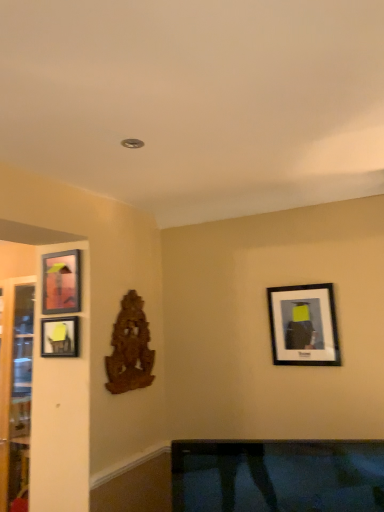
Question: Is matte black picture frame at left, acting as the 3th picture frame starting from the right, closer to camera compared to matte black picture frame at left, the 2th picture frame from the left?

Choices:
 (A) yes
 (B) no

Answer: (B)

Question: Is matte black picture frame at left, marked as the first picture frame in a left-to-right arrangement, behind matte black picture frame at left, the 2th picture frame from the left?

Choices:
 (A) yes
 (B) no

Answer: (A)

Question: Does matte black picture frame at left, acting as the 3th picture frame starting from the right, have a smaller size compared to matte black picture frame at left, arranged as the 2th picture frame when viewed from the right?

Choices:
 (A) no
 (B) yes

Answer: (A)

Question: Could you tell me if matte black picture frame at left, acting as the 3th picture frame starting from the right, is turned towards matte black picture frame at left, the 2th picture frame from the left?

Choices:
 (A) yes
 (B) no

Answer: (B)

Question: Is matte black picture frame at left, the 2th picture frame from the left, a part of matte black picture frame at left, marked as the first picture frame in a left-to-right arrangement?

Choices:
 (A) yes
 (B) no

Answer: (B)

Question: Is matte black picture frame at left, marked as the first picture frame in a left-to-right arrangement, not close to matte black picture frame at left, the 2th picture frame from the left?

Choices:
 (A) yes
 (B) no

Answer: (B)

Question: Can you confirm if transparent glass door at left is bigger than matte black picture frame at upper right, the 3th picture frame viewed from the left?

Choices:
 (A) no
 (B) yes

Answer: (B)

Question: From the image's perspective, is transparent glass door at left on top of matte black picture frame at upper right, which is the first picture frame from right to left?

Choices:
 (A) yes
 (B) no

Answer: (B)

Question: Considering the relative sizes of transparent glass door at left and matte black picture frame at upper right, the 3th picture frame viewed from the left, in the image provided, is transparent glass door at left thinner than matte black picture frame at upper right, the 3th picture frame viewed from the left,?

Choices:
 (A) no
 (B) yes

Answer: (A)

Question: Is matte black picture frame at upper right, which is the first picture frame from right to left, surrounded by transparent glass door at left?

Choices:
 (A) no
 (B) yes

Answer: (A)

Question: Does transparent glass door at left come in front of matte black picture frame at upper right, which is the first picture frame from right to left?

Choices:
 (A) no
 (B) yes

Answer: (A)

Question: Considering the relative sizes of transparent glass door at left and matte black picture frame at upper right, which is the first picture frame from right to left, in the image provided, is transparent glass door at left taller than matte black picture frame at upper right, which is the first picture frame from right to left,?

Choices:
 (A) no
 (B) yes

Answer: (B)

Question: Considering the relative sizes of wooden carving at center-left and matte black picture frame at upper right, the 3th picture frame viewed from the left, in the image provided, is wooden carving at center-left wider than matte black picture frame at upper right, the 3th picture frame viewed from the left,?

Choices:
 (A) no
 (B) yes

Answer: (A)